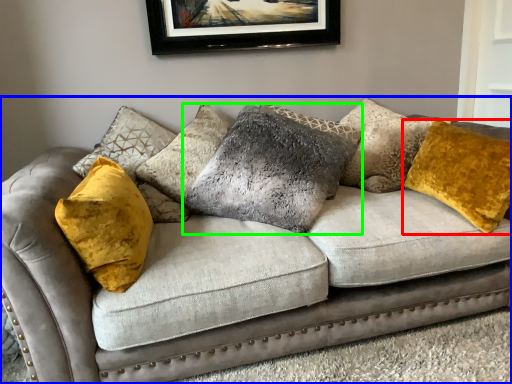
Question: Which object is positioned farthest from pillow (highlighted by a red box)? Select from studio couch (highlighted by a blue box) and pillow (highlighted by a green box).

Choices:
 (A) studio couch
 (B) pillow

Answer: (B)